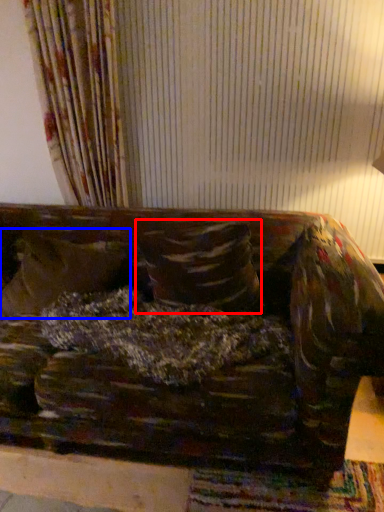
Question: Among these objects, which one is farthest to the camera, pillow (highlighted by a red box) or pillow (highlighted by a blue box)?

Choices:
 (A) pillow
 (B) pillow

Answer: (B)